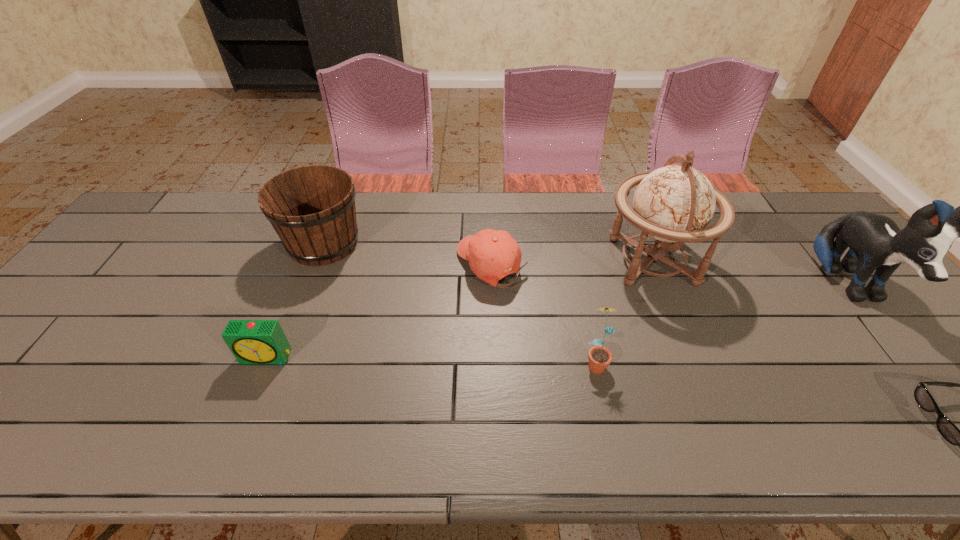
I want to click on free region located 0.270m on the left of the wine bucket, so pyautogui.click(x=194, y=244).

What are the coordinates of `free space located 0.110m on the flower of the sunflower` in the screenshot? It's located at (609, 422).

Locate an element on the screen. vacant position located 0.350m on the right of the baseball cap is located at coordinates tap(647, 265).

You are a GUI agent. You are given a task and a screenshot of the screen. Output one action in this format:
    pyautogui.click(x=<x>, y=<y>)
    Task: Click on the vacant space located on the front-facing side of the alarm clock
    This screenshot has width=960, height=540.
    Given the screenshot: What is the action you would take?
    pyautogui.click(x=231, y=444)

Where is `globe present at the far edge`? This screenshot has height=540, width=960. globe present at the far edge is located at coordinates (674, 203).

Identify the location of wine bucket present at the far edge. (312, 208).

Locate an element on the screen. This screenshot has height=540, width=960. object that is at the right edge is located at coordinates click(x=875, y=242).

This screenshot has height=540, width=960. I want to click on free space at the far edge, so click(x=743, y=197).

You are a GUI agent. You are given a task and a screenshot of the screen. Output one action in this format:
    pyautogui.click(x=<x>, y=<y>)
    Task: Click on the vacant space at the near edge
    This screenshot has width=960, height=540.
    Given the screenshot: What is the action you would take?
    pyautogui.click(x=783, y=442)

Where is `free space at the left edge of the desktop`? free space at the left edge of the desktop is located at coordinates (8, 408).